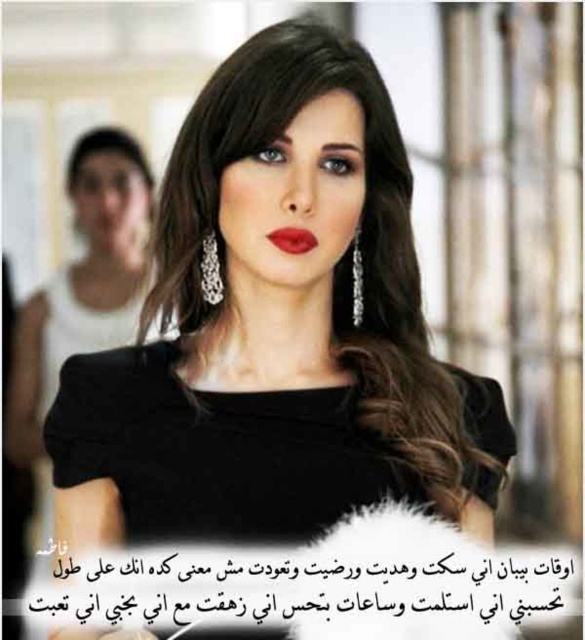
You are a photographer adjusting the camera focus. The subject has a shiny dark brown hair at center. Where should you position the focus point to ensure the hair is sharp?

The focus point should be positioned at coordinates point (315, 246) to ensure the shiny dark brown hair at center is sharp.

You are taking a photo of the woman in the center wearing a black top with a fur collar. The camera is focused on her face. Where would the point at coordinates point (x=315, y=246) be located on her?

The point at coordinates point (x=315, y=246) is on shiny dark brown hair at center.